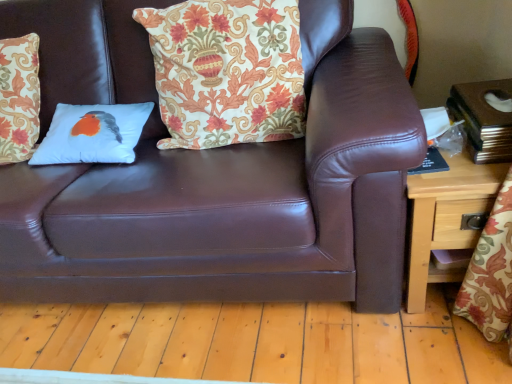
Question: Is wooden side table at right wider or thinner than brown leather couch at center?

Choices:
 (A) wide
 (B) thin

Answer: (B)

Question: Considering the relative positions of wooden side table at right and brown leather couch at center in the image provided, is wooden side table at right to the left or to the right of brown leather couch at center?

Choices:
 (A) left
 (B) right

Answer: (B)

Question: Estimate the real-world distances between objects in this image. Which object is closer to the brown leather couch at center?

Choices:
 (A) wooden side table at right
 (B) white matte pillow with bird design at center, which ranks as the first pillow in left-to-right order
 (C) white fabric pillow with bird design at center, the second pillow in the left-to-right sequence

Answer: (C)

Question: Based on their relative distances, which object is nearer to the white fabric pillow with bird design at center, the second pillow in the left-to-right sequence?

Choices:
 (A) wooden side table at right
 (B) brown leather couch at center
 (C) white matte pillow with bird design at center, which ranks as the 2th pillow in right-to-left order

Answer: (B)